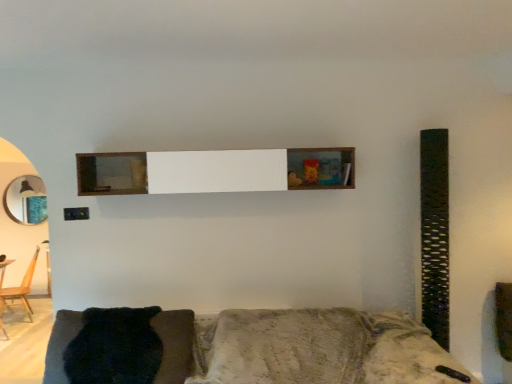
Question: From the image's perspective, is textured gray couch at lower center positioned above or below wooden table at lower left?

Choices:
 (A) below
 (B) above

Answer: (B)

Question: Considering the positions of textured gray couch at lower center and wooden table at lower left in the image, is textured gray couch at lower center bigger or smaller than wooden table at lower left?

Choices:
 (A) small
 (B) big

Answer: (B)

Question: Which is farther from the wooden table at lower left?

Choices:
 (A) dark fuzzy pillow at lower left
 (B) wooden shelf at center
 (C) wooden chair at left
 (D) metallic circular mirror at left
 (E) textured gray couch at lower center

Answer: (E)

Question: Which is nearer to the wooden table at lower left?

Choices:
 (A) textured gray couch at lower center
 (B) dark fuzzy pillow at lower left
 (C) wooden shelf at center
 (D) metallic circular mirror at left
 (E) wooden chair at left

Answer: (E)